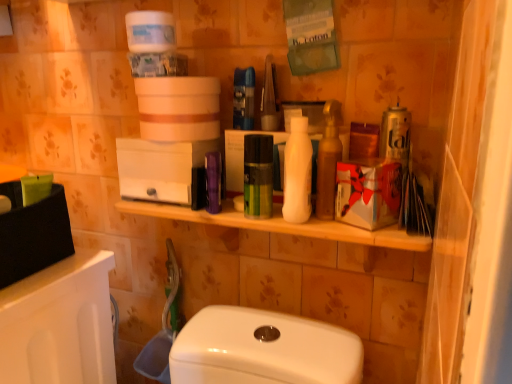
Question: Is point (330, 177) positioned closer to the camera than point (211, 165)?

Choices:
 (A) closer
 (B) farther

Answer: (A)

Question: In the image, is shiny brown bottle at center positioned in front of or behind purple plastic container at center, the second toiletry from the right?

Choices:
 (A) front
 (B) behind

Answer: (A)

Question: Estimate the real-world distances between objects in this image. Which object is farther from the matte cardboard box at center?

Choices:
 (A) white matte bottle at center, which is counted as the second toiletry, starting from the left
 (B) green matte mouthwash at center
 (C) shiny brown bottle at center
 (D) purple plastic container at center, the second toiletry from the right

Answer: (D)

Question: Considering the real-world distances, which object is farthest from the matte cardboard box at center?

Choices:
 (A) shiny brown bottle at center
 (B) white matte bottle at center, which is counted as the second toiletry, starting from the left
 (C) purple plastic container at center, arranged as the first toiletry when viewed from the left
 (D) green matte mouthwash at center

Answer: (C)